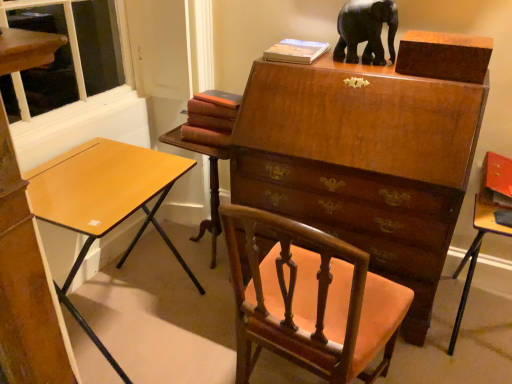
Question: Which direction should I rotate to look at mahogany wood table at center, which is the first table in left-to-right order?

Choices:
 (A) left
 (B) right

Answer: (A)

Question: From a real-world perspective, is mahogany wood table at center, which appears as the 2th table when viewed from the right, positioned under black glossy elephant at upper center based on gravity?

Choices:
 (A) yes
 (B) no

Answer: (A)

Question: From the image's perspective, is mahogany wood table at center, which appears as the 2th table when viewed from the right, on black glossy elephant at upper center?

Choices:
 (A) no
 (B) yes

Answer: (A)

Question: Considering the relative sizes of mahogany wood table at center, which appears as the 2th table when viewed from the right, and black glossy elephant at upper center in the image provided, is mahogany wood table at center, which appears as the 2th table when viewed from the right, shorter than black glossy elephant at upper center?

Choices:
 (A) no
 (B) yes

Answer: (A)

Question: Considering the relative positions of mahogany wood table at center, which is the first table in left-to-right order, and black glossy elephant at upper center in the image provided, is mahogany wood table at center, which is the first table in left-to-right order, behind black glossy elephant at upper center?

Choices:
 (A) yes
 (B) no

Answer: (A)

Question: From a real-world perspective, is mahogany wood table at center, which is the first table in left-to-right order, positioned over black glossy elephant at upper center based on gravity?

Choices:
 (A) no
 (B) yes

Answer: (A)

Question: Can you confirm if mahogany wood table at center, which is the first table in left-to-right order, is smaller than black glossy elephant at upper center?

Choices:
 (A) yes
 (B) no

Answer: (B)

Question: From the image's perspective, is light brown wood desk at left over mahogany wood table at center, which appears as the 2th table when viewed from the right?

Choices:
 (A) no
 (B) yes

Answer: (A)

Question: Is light brown wood desk at left next to mahogany wood table at center, which appears as the 2th table when viewed from the right?

Choices:
 (A) no
 (B) yes

Answer: (A)

Question: Does light brown wood desk at left have a lesser height compared to mahogany wood table at center, which is the first table in left-to-right order?

Choices:
 (A) no
 (B) yes

Answer: (A)

Question: Considering the relative sizes of light brown wood desk at left and mahogany wood table at center, which is the first table in left-to-right order, in the image provided, is light brown wood desk at left wider than mahogany wood table at center, which is the first table in left-to-right order,?

Choices:
 (A) yes
 (B) no

Answer: (A)

Question: Can you confirm if light brown wood desk at left is taller than mahogany wood table at center, which appears as the 2th table when viewed from the right?

Choices:
 (A) yes
 (B) no

Answer: (A)

Question: Is the position of light brown wood desk at left less distant than that of mahogany wood table at center, which is the first table in left-to-right order?

Choices:
 (A) no
 (B) yes

Answer: (B)

Question: Is hardcover book at upper center, placed as the 1th book when sorted from right to left, positioned in front of light brown wood desk at left?

Choices:
 (A) no
 (B) yes

Answer: (A)